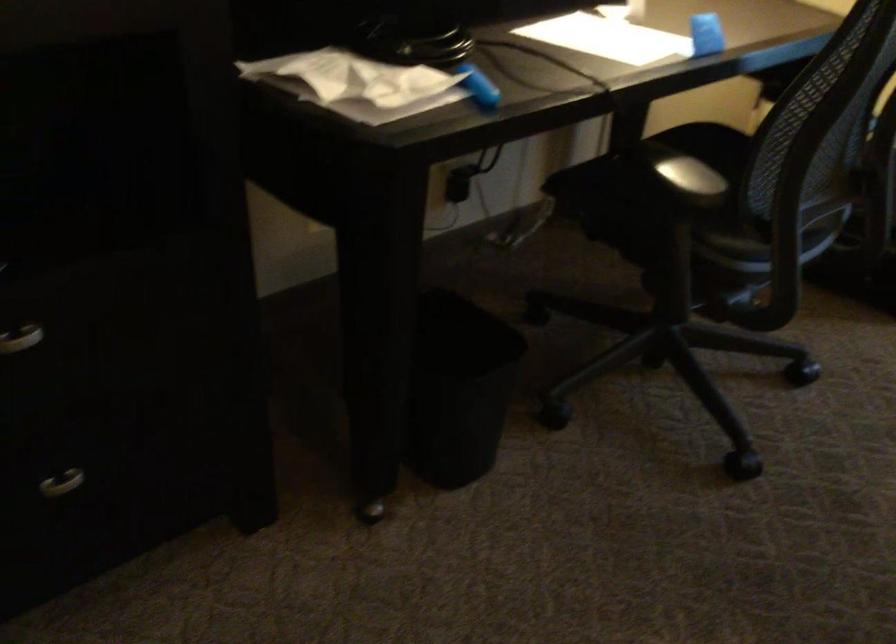
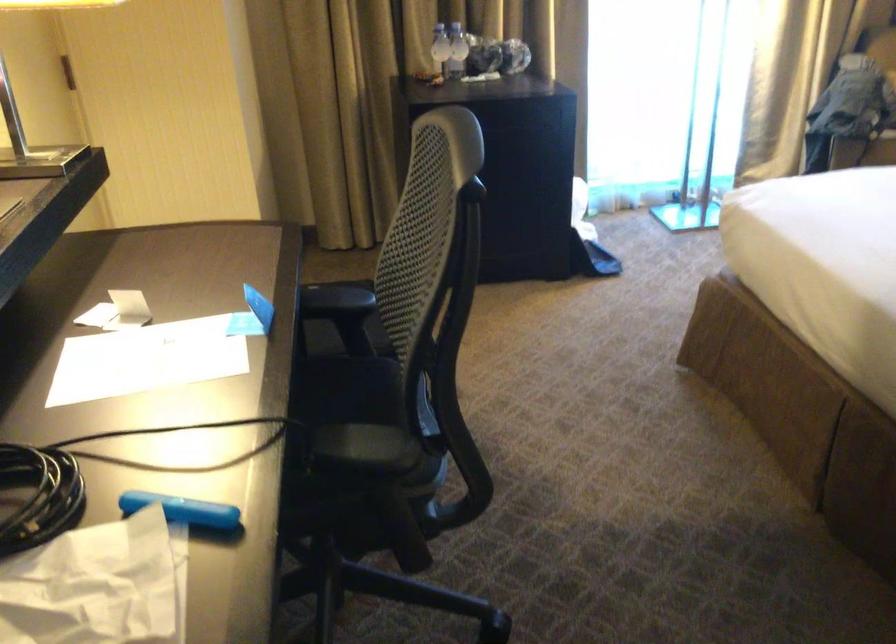
Question: The first image is from the beginning of the video and the second image is from the end. How did the camera likely rotate when shooting the video?

Choices:
 (A) Left
 (B) Right
 (C) Up
 (D) Down

Answer: (B)